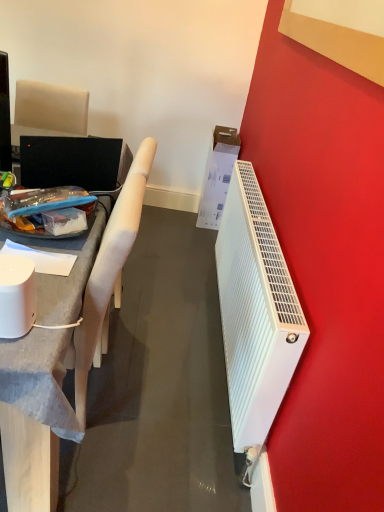
Question: Considering the relative sizes of matte gray desk at left and white fabric chair at left in the image provided, is matte gray desk at left bigger than white fabric chair at left?

Choices:
 (A) no
 (B) yes

Answer: (B)

Question: Considering the relative sizes of matte gray desk at left and white fabric chair at left in the image provided, is matte gray desk at left wider than white fabric chair at left?

Choices:
 (A) no
 (B) yes

Answer: (B)

Question: From a real-world perspective, does matte gray desk at left sit lower than white fabric chair at left?

Choices:
 (A) no
 (B) yes

Answer: (B)

Question: Does matte gray desk at left lie in front of white fabric chair at left?

Choices:
 (A) yes
 (B) no

Answer: (A)

Question: From the image's perspective, would you say matte gray desk at left is positioned over white fabric chair at left?

Choices:
 (A) yes
 (B) no

Answer: (A)

Question: Does point (1, 274) appear closer or farther from the camera than point (148, 167)?

Choices:
 (A) farther
 (B) closer

Answer: (B)

Question: Is white glossy smart speaker at left inside or outside of white fabric chair at left?

Choices:
 (A) outside
 (B) inside

Answer: (A)

Question: Is white glossy smart speaker at left wider or thinner than white fabric chair at left?

Choices:
 (A) wide
 (B) thin

Answer: (B)

Question: Is white glossy smart speaker at left to the left or to the right of white fabric chair at left in the image?

Choices:
 (A) right
 (B) left

Answer: (A)

Question: From the image's perspective, relative to white fabric chair at left, is white plastic radiator at right above or below?

Choices:
 (A) below
 (B) above

Answer: (B)

Question: In terms of width, does white plastic radiator at right look wider or thinner when compared to white fabric chair at left?

Choices:
 (A) wide
 (B) thin

Answer: (B)

Question: Does point (256, 240) appear closer or farther from the camera than point (127, 181)?

Choices:
 (A) closer
 (B) farther

Answer: (B)

Question: In terms of size, does white plastic radiator at right appear bigger or smaller than white fabric chair at left?

Choices:
 (A) big
 (B) small

Answer: (B)

Question: Is white glossy smart speaker at left situated inside matte gray desk at left or outside?

Choices:
 (A) outside
 (B) inside

Answer: (A)

Question: Considering their positions, is white glossy smart speaker at left located in front of or behind matte gray desk at left?

Choices:
 (A) front
 (B) behind

Answer: (B)